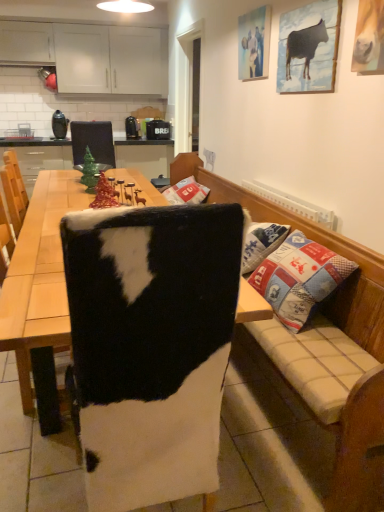
What do you see at coordinates (254, 42) in the screenshot?
I see `wooden picture frame at upper center, acting as the first picture frame starting from the back` at bounding box center [254, 42].

In order to face cowhide at center, should I rotate leftwards or rightwards?

To face it directly, rotate left by 7.847 degrees.

This screenshot has width=384, height=512. Identify the location of green glossy christmas tree at upper left. (90, 172).

This screenshot has width=384, height=512. Describe the element at coordinates (91, 56) in the screenshot. I see `white matte cabinets at upper left` at that location.

You are a GUI agent. You are given a task and a screenshot of the screen. Output one action in this format:
    pyautogui.click(x=<x>, y=<y>)
    Task: Click on the wooden picture frame at upper center, the second picture frame in the right-to-left sequence
    The width and height of the screenshot is (384, 512).
    Given the screenshot: What is the action you would take?
    point(254,42)

From the image's perspective, which is above, white matte cabinets at upper left or green glossy christmas tree at upper left?

From the image's view, white matte cabinets at upper left is above.

Measure the distance between white matte cabinets at upper left and green glossy christmas tree at upper left.

A distance of 13.46 feet exists between white matte cabinets at upper left and green glossy christmas tree at upper left.

Find the location of a particular element. The image size is (384, 512). christmas tree that is in front of the white matte cabinets at upper left is located at coordinates (90, 172).

From a real-world perspective, is white matte cabinets at upper left positioned above or below green glossy christmas tree at upper left?

white matte cabinets at upper left is above green glossy christmas tree at upper left.

Could white matte cabinets at upper left be considered to be inside green glossy christmas tree at upper left?

No, white matte cabinets at upper left is not a part of green glossy christmas tree at upper left.

How far apart are green glossy christmas tree at upper left and white matte cabinets at upper left?

green glossy christmas tree at upper left and white matte cabinets at upper left are 4.10 meters apart from each other.

Which is in front, green glossy christmas tree at upper left or white matte cabinets at upper left?

Positioned in front is green glossy christmas tree at upper left.

From the image's perspective, is green glossy christmas tree at upper left above white matte cabinets at upper left?

No, from the image's perspective, green glossy christmas tree at upper left is not above white matte cabinets at upper left.

Considering the positions of objects wooden picture frame at upper center, the second picture frame in the front-to-back sequence, and wooden picture frame at upper right, which is counted as the 2th picture frame, starting from the left, in the image provided, who is more to the left, wooden picture frame at upper center, the second picture frame in the front-to-back sequence, or wooden picture frame at upper right, which is counted as the 2th picture frame, starting from the left,?

wooden picture frame at upper center, the second picture frame in the front-to-back sequence, is more to the left.

In terms of width, does wooden picture frame at upper center, the second picture frame in the right-to-left sequence, look wider or thinner when compared to wooden picture frame at upper right, which appears as the 1th picture frame when viewed from the front?

Considering their sizes, wooden picture frame at upper center, the second picture frame in the right-to-left sequence, looks broader than wooden picture frame at upper right, which appears as the 1th picture frame when viewed from the front.

Does wooden picture frame at upper center, the second picture frame in the right-to-left sequence, touch wooden picture frame at upper right, which is counted as the 2th picture frame, starting from the left?

wooden picture frame at upper center, the second picture frame in the right-to-left sequence, and wooden picture frame at upper right, which is counted as the 2th picture frame, starting from the left, are not in contact.

Based on the photo, can you tell me how much wooden picture frame at upper center, the second picture frame in the front-to-back sequence, and wooden picture frame at upper right, which appears as the 1th picture frame when viewed from the front, differ in facing direction?

wooden picture frame at upper center, the second picture frame in the front-to-back sequence, and wooden picture frame at upper right, which appears as the 1th picture frame when viewed from the front, are facing 1.73 degrees away from each other.

Between point (324, 18) and point (167, 74), which one is positioned behind?

Point (167, 74)

From the image's perspective, is wooden picture frame at upper right, which is counted as the 2th picture frame, starting from the left, above white matte cabinets at upper left?

No, from the image's perspective, wooden picture frame at upper right, which is counted as the 2th picture frame, starting from the left, is not over white matte cabinets at upper left.

Does wooden picture frame at upper right, the first picture frame when ordered from right to left, lie in front of white matte cabinets at upper left?

That is True.

Between wooden picture frame at upper right, the first picture frame when ordered from right to left, and white matte cabinets at upper left, which one has larger size?

white matte cabinets at upper left is bigger.

Considering the sizes of green glossy christmas tree at upper left and cowhide cushion at center in the image, is green glossy christmas tree at upper left wider or thinner than cowhide cushion at center?

Clearly, green glossy christmas tree at upper left has less width compared to cowhide cushion at center.

Which object is further away from the camera, green glossy christmas tree at upper left or cowhide cushion at center?

green glossy christmas tree at upper left is further from the camera.

In the scene shown: Can you confirm if green glossy christmas tree at upper left is positioned to the left of cowhide cushion at center?

Yes.

Is cowhide cushion at center a part of green glossy christmas tree at upper left?

No, cowhide cushion at center is not surrounded by green glossy christmas tree at upper left.

Measure the distance between cowhide cushion at center and green glossy christmas tree at upper left.

cowhide cushion at center and green glossy christmas tree at upper left are 3.67 feet apart from each other.

Consider the image. Can you confirm if cowhide cushion at center is smaller than green glossy christmas tree at upper left?

Actually, cowhide cushion at center might be larger than green glossy christmas tree at upper left.

Where is `christmas tree on the left of cowhide cushion at center`? This screenshot has width=384, height=512. christmas tree on the left of cowhide cushion at center is located at coordinates (90, 172).

Which of these two, wooden picture frame at upper center, acting as the first picture frame starting from the back, or green glossy christmas tree at upper left, is bigger?

With larger size is wooden picture frame at upper center, acting as the first picture frame starting from the back.

Is wooden picture frame at upper center, the second picture frame in the right-to-left sequence, far from green glossy christmas tree at upper left?

wooden picture frame at upper center, the second picture frame in the right-to-left sequence, is positioned a significant distance from green glossy christmas tree at upper left.

Does point (250, 22) come farther from viewer compared to point (86, 189)?

Yes, it is.

Looking at this image, is green glossy christmas tree at upper left completely or partially inside wooden picture frame at upper center, the second picture frame in the right-to-left sequence?

Actually, green glossy christmas tree at upper left is outside wooden picture frame at upper center, the second picture frame in the right-to-left sequence.

I want to click on christmas tree that appears in front of the white matte cabinets at upper left, so click(x=90, y=172).

In the image, there is a white matte cabinets at upper left. Where is `christmas tree below it (from a real-world perspective)`? This screenshot has height=512, width=384. christmas tree below it (from a real-world perspective) is located at coordinates (90, 172).

Which object lies further to the anchor point wooden picture frame at upper right, the first picture frame when ordered from right to left, white matte cabinets at upper left or cowhide at center?

Among the two, white matte cabinets at upper left is located further to wooden picture frame at upper right, the first picture frame when ordered from right to left.

Looking at the image, which one is located closer to wooden picture frame at upper right, the first picture frame when ordered from right to left, white matte cabinets at upper left or green glossy christmas tree at upper left?

green glossy christmas tree at upper left.

When comparing their distances from cowhide cushion at center, does white matte cabinets at upper left or cowhide at center seem further?

white matte cabinets at upper left lies further to cowhide cushion at center than the other object.

When comparing their distances from white matte cabinets at upper left, does wooden picture frame at upper right, which is counted as the 2th picture frame, starting from the left, or cowhide cushion at center seem further?

wooden picture frame at upper right, which is counted as the 2th picture frame, starting from the left.

When comparing their distances from wooden picture frame at upper right, positioned as the second picture frame in back-to-front order, does wooden picture frame at upper center, which appears as the 1th picture frame when viewed from the left, or green glossy christmas tree at upper left seem closer?

Among the two, wooden picture frame at upper center, which appears as the 1th picture frame when viewed from the left, is located nearer to wooden picture frame at upper right, positioned as the second picture frame in back-to-front order.

From the image, which object appears to be nearer to white matte cabinets at upper left, cowhide cushion at center or wooden picture frame at upper center, the second picture frame in the front-to-back sequence?

cowhide cushion at center.

From the image, which object appears to be farther from white matte cabinets at upper left, wooden picture frame at upper center, the second picture frame in the right-to-left sequence, or green glossy christmas tree at upper left?

The object further to white matte cabinets at upper left is green glossy christmas tree at upper left.

Estimate the real-world distances between objects in this image. Which object is closer to wooden picture frame at upper right, the first picture frame when ordered from right to left, cowhide at center or white matte cabinets at upper left?

cowhide at center lies closer to wooden picture frame at upper right, the first picture frame when ordered from right to left, than the other object.

I want to click on picture frame situated between green glossy christmas tree at upper left and wooden picture frame at upper right, the first picture frame when ordered from right to left, from left to right, so click(254, 42).

The width and height of the screenshot is (384, 512). I want to click on studio couch between wooden picture frame at upper right, which is counted as the 2th picture frame, starting from the left, and cowhide at center in the up-down direction, so click(312, 239).

Identify the location of christmas tree between wooden picture frame at upper right, the first picture frame when ordered from right to left, and white matte cabinets at upper left, along the z-axis. The height and width of the screenshot is (512, 384). (90, 172).

The width and height of the screenshot is (384, 512). I want to click on christmas tree located between cowhide cushion at center and white matte cabinets at upper left in the depth direction, so click(x=90, y=172).